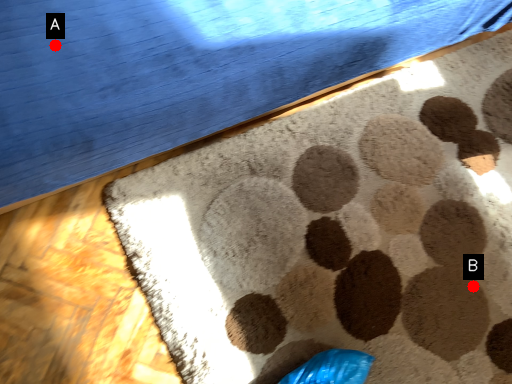
Question: Two points are circled on the image, labeled by A and B beside each circle. Which of the following is the farthest from the observer?

Choices:
 (A) A is further
 (B) B is further

Answer: (B)